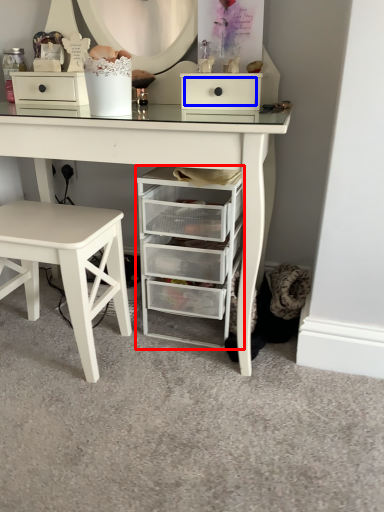
Question: Which object is further to the camera taking this photo, chest of drawers (highlighted by a red box) or drawer (highlighted by a blue box)?

Choices:
 (A) chest of drawers
 (B) drawer

Answer: (B)